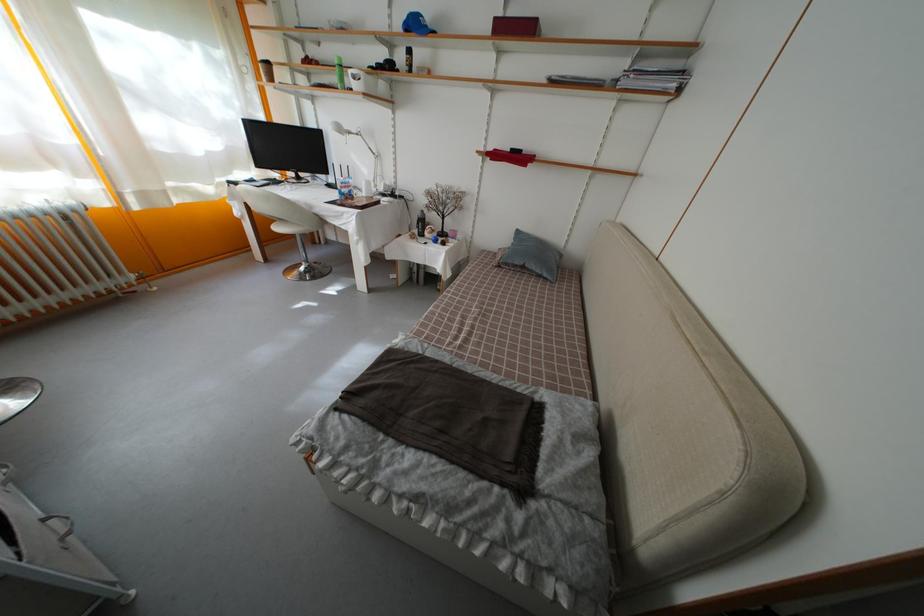
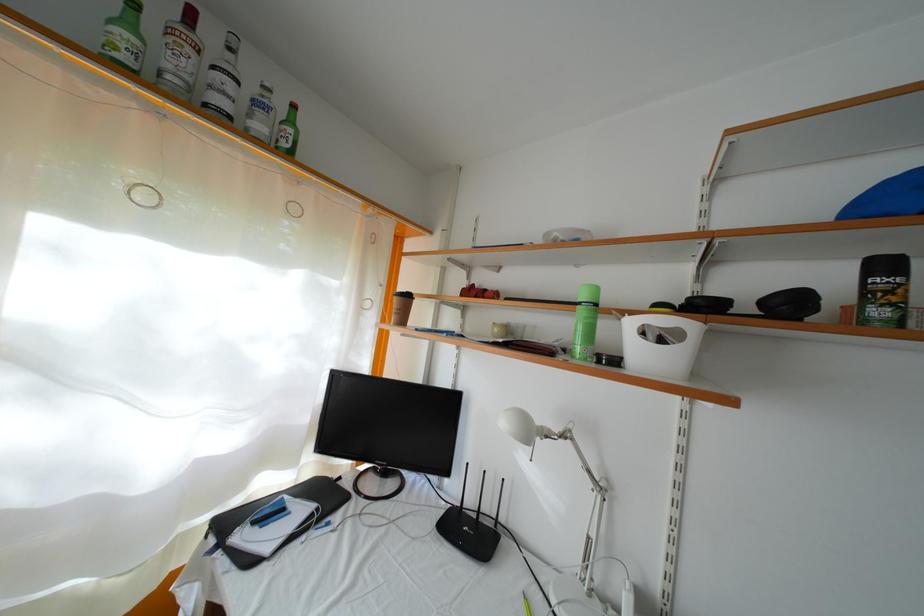
Find the pixel in the second image that matches point (280, 188) in the first image.

(334, 506)